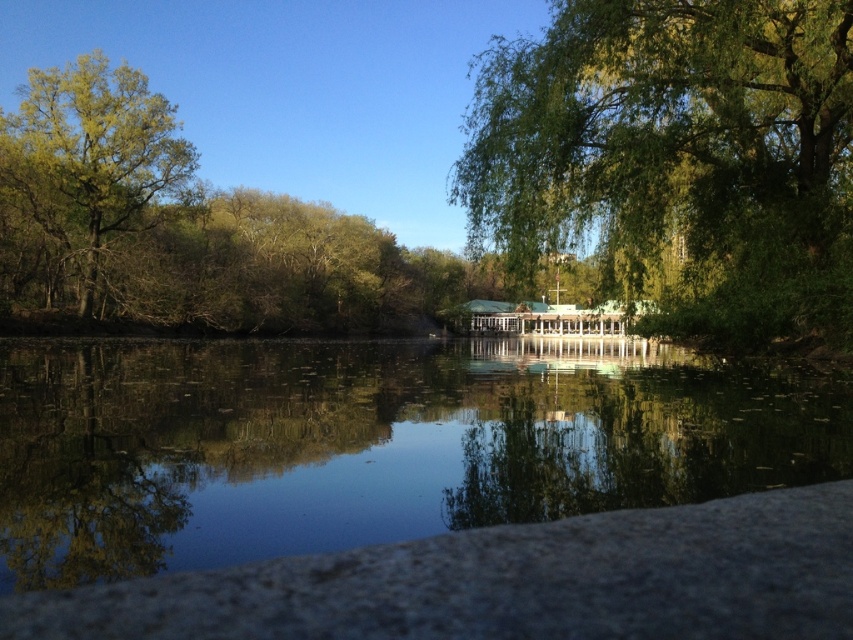
Can you confirm if smooth reflective water at center is thinner than green leafy tree at left?

No.

Between smooth reflective water at center and green leafy tree at left, which one has less height?

smooth reflective water at center is shorter.

Which is behind, point (340, 484) or point (155, 141)?

The point (155, 141) is more distant.

The height and width of the screenshot is (640, 853). I want to click on smooth reflective water at center, so click(369, 444).

Can you confirm if smooth reflective water at center is thinner than green leafy tree at upper right?

No.

Which of these two, smooth reflective water at center or green leafy tree at upper right, stands shorter?

With less height is smooth reflective water at center.

Does point (627, 417) come behind point (515, 243)?

No, it is in front of (515, 243).

Where is `smooth reflective water at center`? This screenshot has height=640, width=853. smooth reflective water at center is located at coordinates (369, 444).

Can you confirm if green leafy tree at upper right is positioned to the left of green leafy tree at left?

No, green leafy tree at upper right is not to the left of green leafy tree at left.

From the picture: Can you confirm if green leafy tree at upper right is positioned above green leafy tree at left?

Indeed, green leafy tree at upper right is positioned over green leafy tree at left.

Is point (781, 10) in front of point (128, 154)?

That is True.

The width and height of the screenshot is (853, 640). I want to click on green leafy tree at upper right, so click(x=677, y=154).